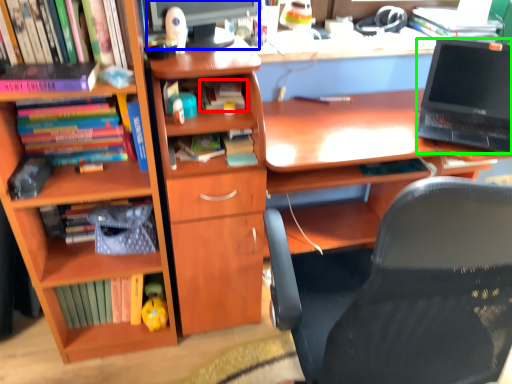
Question: Which is nearer to the book (highlighted by a red box)? computer monitor (highlighted by a blue box) or laptop (highlighted by a green box).

Choices:
 (A) computer monitor
 (B) laptop

Answer: (A)